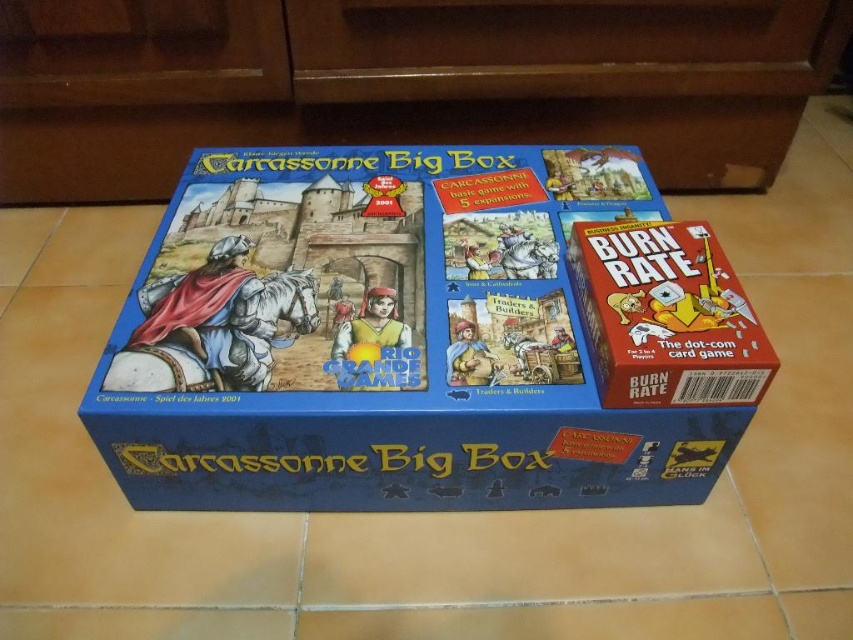
Question: Can you confirm if blue cardboard carcassonne big box at center is bigger than matte cardboard box at right?

Choices:
 (A) no
 (B) yes

Answer: (B)

Question: Is blue cardboard carcassonne big box at center to the left of matte cardboard box at right from the viewer's perspective?

Choices:
 (A) no
 (B) yes

Answer: (B)

Question: Which point appears closest to the camera in this image?

Choices:
 (A) (595, 328)
 (B) (343, 442)

Answer: (B)

Question: Which point is farther to the camera?

Choices:
 (A) (473, 388)
 (B) (720, 385)

Answer: (A)

Question: Is blue cardboard carcassonne big box at center thinner than matte cardboard box at right?

Choices:
 (A) yes
 (B) no

Answer: (B)